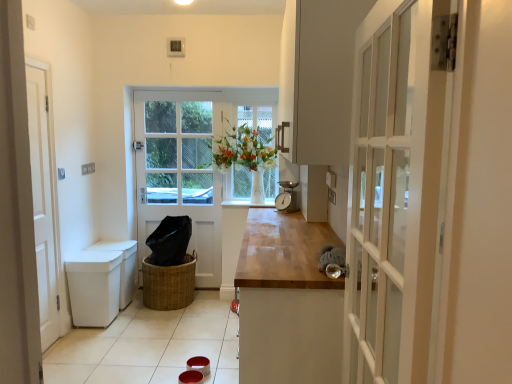
Question: Which direction should I rotate to look at white wooden door at center, the 1th door from the back?

Choices:
 (A) left
 (B) right

Answer: (A)

Question: From a real-world perspective, is white wooden door at left, the first door from the front, positioned over woven brown basket at center based on gravity?

Choices:
 (A) no
 (B) yes

Answer: (B)

Question: Is white wooden door at left, the first door from the front, to the left of woven brown basket at center from the viewer's perspective?

Choices:
 (A) yes
 (B) no

Answer: (A)

Question: From a real-world perspective, is white wooden door at left, the second door viewed from the back, beneath woven brown basket at center?

Choices:
 (A) yes
 (B) no

Answer: (B)

Question: Is white wooden door at left, the second door viewed from the back, thinner than woven brown basket at center?

Choices:
 (A) no
 (B) yes

Answer: (B)

Question: Is white wooden door at left, the first door from the front, further to the viewer compared to woven brown basket at center?

Choices:
 (A) no
 (B) yes

Answer: (A)

Question: Can you confirm if white wooden door at left, which ranks as the first door in left-to-right order, is wider than woven brown basket at center?

Choices:
 (A) yes
 (B) no

Answer: (B)

Question: From a real-world perspective, is white plastic bin at lower left under metallic silver scale at center?

Choices:
 (A) yes
 (B) no

Answer: (A)

Question: Is white plastic bin at lower left looking in the opposite direction of metallic silver scale at center?

Choices:
 (A) yes
 (B) no

Answer: (B)

Question: From the image's perspective, is white plastic bin at lower left on top of metallic silver scale at center?

Choices:
 (A) no
 (B) yes

Answer: (A)

Question: Considering the relative sizes of white plastic bin at lower left and metallic silver scale at center in the image provided, is white plastic bin at lower left thinner than metallic silver scale at center?

Choices:
 (A) yes
 (B) no

Answer: (B)

Question: Is white plastic bin at lower left outside of metallic silver scale at center?

Choices:
 (A) no
 (B) yes

Answer: (B)

Question: Does white plastic bin at lower left have a greater width compared to metallic silver scale at center?

Choices:
 (A) no
 (B) yes

Answer: (B)

Question: Is the depth of white glossy window sill at center less than that of white wooden door at left, the first door from the front?

Choices:
 (A) no
 (B) yes

Answer: (A)